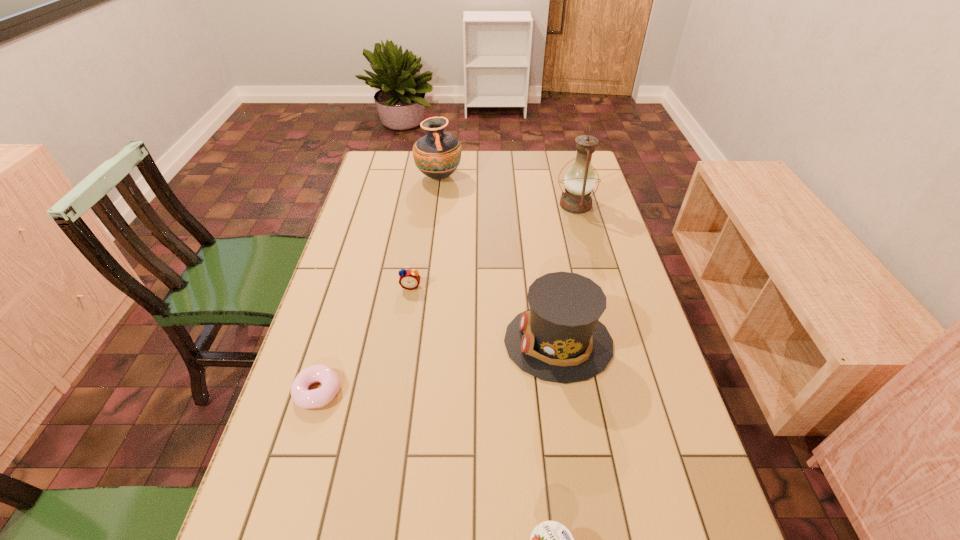
Where is `vacant area located with goggles on the front of the fourth shortest object`? vacant area located with goggles on the front of the fourth shortest object is located at coordinates (417, 342).

Where is `vacant space located with goggles on the front of the fourth shortest object`? The image size is (960, 540). vacant space located with goggles on the front of the fourth shortest object is located at coordinates (480, 342).

Find the location of a particular element. This screenshot has width=960, height=540. free space located with goggles on the front of the fourth shortest object is located at coordinates (409, 342).

Identify the location of vacant space located 0.330m on the front-facing side of the alarm clock. The image size is (960, 540). (394, 394).

The height and width of the screenshot is (540, 960). I want to click on free space located on the back of the doughnut, so click(345, 304).

Locate an element on the screen. Image resolution: width=960 pixels, height=540 pixels. object at the far edge is located at coordinates (437, 155).

Find the location of a particular element. The image size is (960, 540). object that is positioned at the left edge is located at coordinates (303, 398).

Identify the location of oil lamp at the right edge. The width and height of the screenshot is (960, 540). (x=579, y=181).

Where is `dress hat located in the right edge section of the desktop`? Image resolution: width=960 pixels, height=540 pixels. dress hat located in the right edge section of the desktop is located at coordinates (559, 339).

Locate an element on the screen. The image size is (960, 540). free region at the far edge of the desktop is located at coordinates (488, 173).